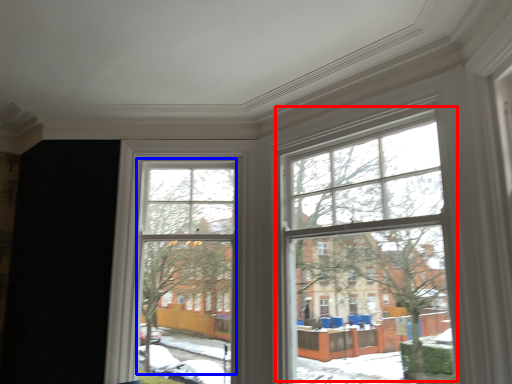
Question: Which object appears closest to the camera in this image, bay window (highlighted by a red box) or bay window (highlighted by a blue box)?

Choices:
 (A) bay window
 (B) bay window

Answer: (A)